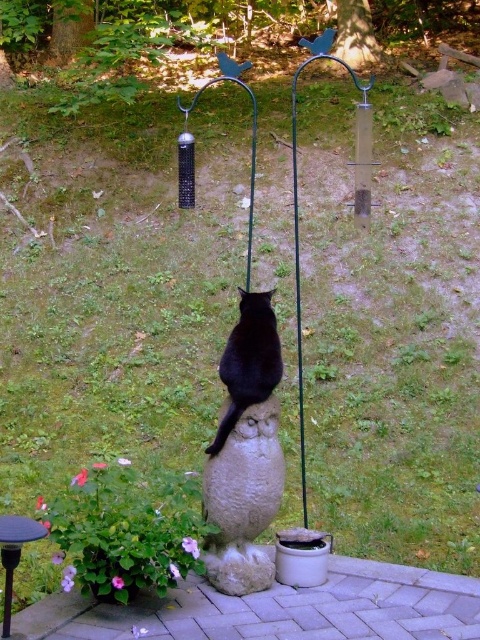
Question: Which is farther from the metallic green swing at center?

Choices:
 (A) metallic black stool at lower left
 (B) black matte cat at center

Answer: (B)

Question: Is black matte cat at center smaller than metallic black stool at lower left?

Choices:
 (A) yes
 (B) no

Answer: (B)

Question: Which of the following is the farthest from the observer?

Choices:
 (A) metallic green swing at center
 (B) white stone owl at center
 (C) metallic black stool at lower left
 (D) black matte cat at center

Answer: (A)

Question: In this image, where is black matte cat at center located relative to metallic black stool at lower left?

Choices:
 (A) left
 (B) right

Answer: (B)

Question: Estimate the real-world distances between objects in this image. Which object is farther from the white stone owl at center?

Choices:
 (A) metallic green swing at center
 (B) metallic black stool at lower left

Answer: (A)

Question: Does metallic green swing at center appear on the left side of black matte cat at center?

Choices:
 (A) no
 (B) yes

Answer: (A)